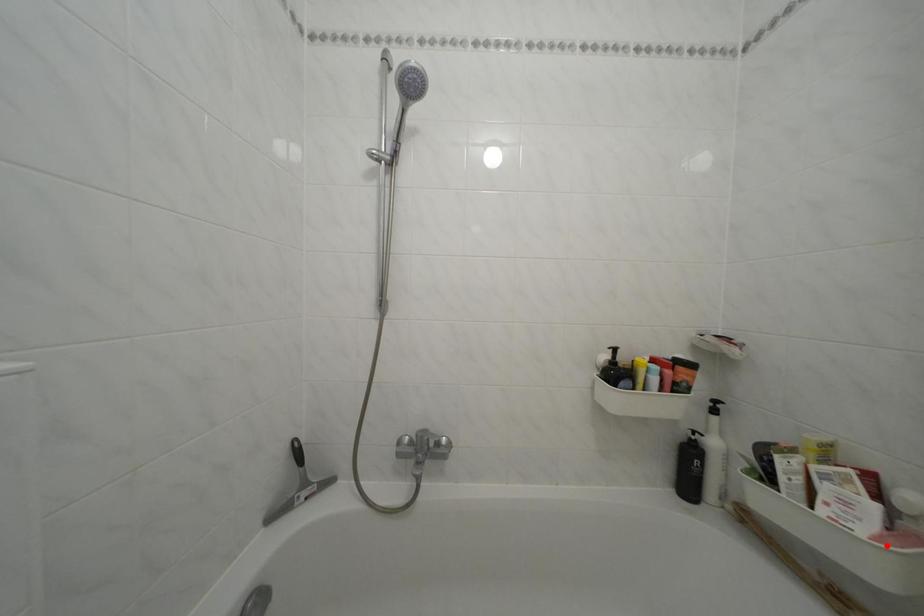
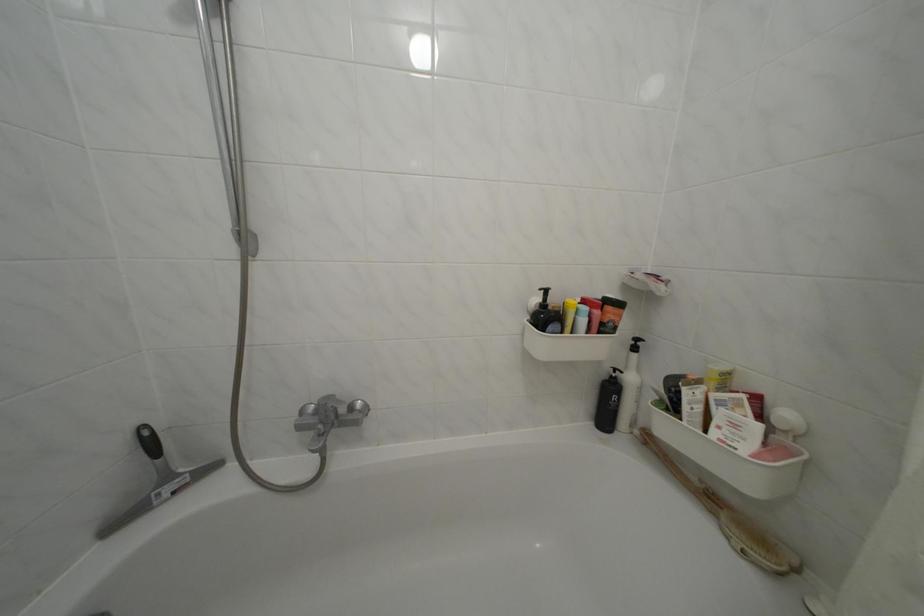
Question: A red point is marked in image1. In image2, is the corresponding 3D point closer to the camera or farther? Reply with the corresponding letter.

Choices:
 (A) The corresponding 3D point is closer.
 (B) The corresponding 3D point is farther.

Answer: (A)